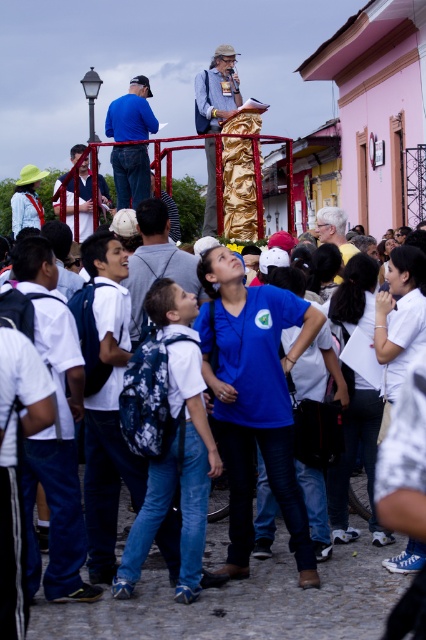
This screenshot has width=426, height=640. Describe the element at coordinates (157, 260) in the screenshot. I see `blue backpack at center` at that location.

Which of these two, blue backpack at center or matte black shirt at center, stands taller?

matte black shirt at center is taller.

From the picture: Measure the distance between point (189, 272) and camera.

Point (189, 272) and camera are 19.63 meters apart.

Find the location of a particular element. The image size is (426, 640). blue backpack at center is located at coordinates (157, 260).

Can you confirm if white backpack at center is positioned to the left of gray hair at center?

Correct, you'll find white backpack at center to the left of gray hair at center.

Between white backpack at center and gray hair at center, which one has more height?

gray hair at center

Identify the location of white backpack at center. The height and width of the screenshot is (640, 426). (169, 436).

Where is `white backpack at center`? This screenshot has width=426, height=640. white backpack at center is located at coordinates (169, 436).

Is white backpack at center to the left of blue backpack at center from the viewer's perspective?

No, white backpack at center is not to the left of blue backpack at center.

Locate an element on the screen. white backpack at center is located at coordinates (169, 436).